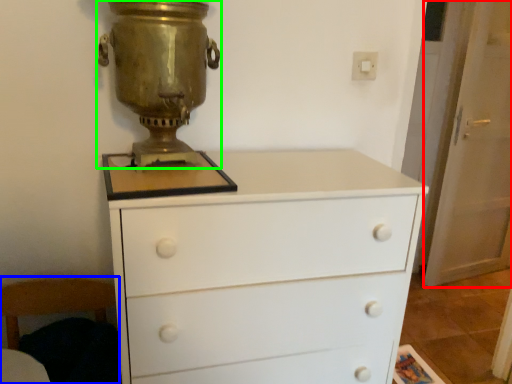
Question: Considering the real-world distances, which object is farthest from screen door (highlighted by a red box)? armchair (highlighted by a blue box) or candle holder (highlighted by a green box)?

Choices:
 (A) armchair
 (B) candle holder

Answer: (A)